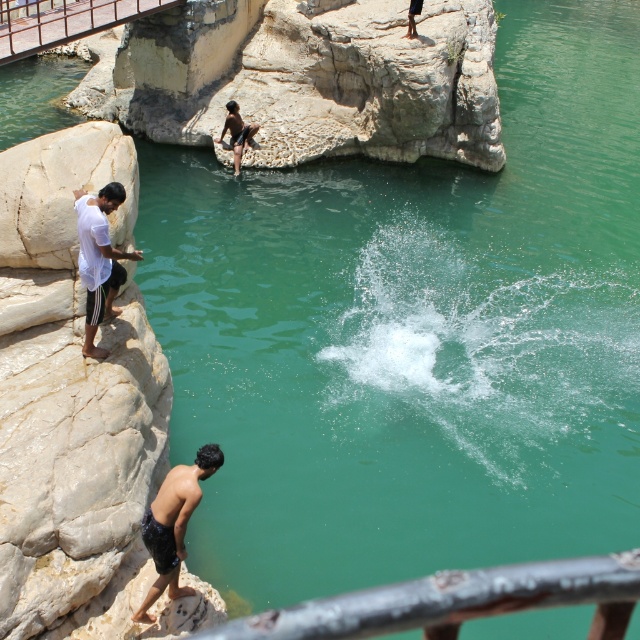
Question: Estimate the real-world distances between objects in this image. Which object is closer to the dark brown skin at center?

Choices:
 (A) rusty metal rail at lower center
 (B) brushed metal rail at upper left
 (C) black matte shorts at lower left

Answer: (B)

Question: Which point appears closest to the camera in this image?

Choices:
 (A) (237, 148)
 (B) (93, 296)

Answer: (B)

Question: Which of the following is the farthest from the observer?

Choices:
 (A) dark brown skin at center
 (B) brushed metal rail at upper left

Answer: (A)

Question: Is rusty metal rail at lower center in front of brushed metal rail at upper left?

Choices:
 (A) yes
 (B) no

Answer: (A)

Question: Does brushed metal rail at upper left appear on the left side of black matte shorts at lower left?

Choices:
 (A) yes
 (B) no

Answer: (A)

Question: Is brushed metal rail at upper left above dark brown skin at center?

Choices:
 (A) yes
 (B) no

Answer: (A)